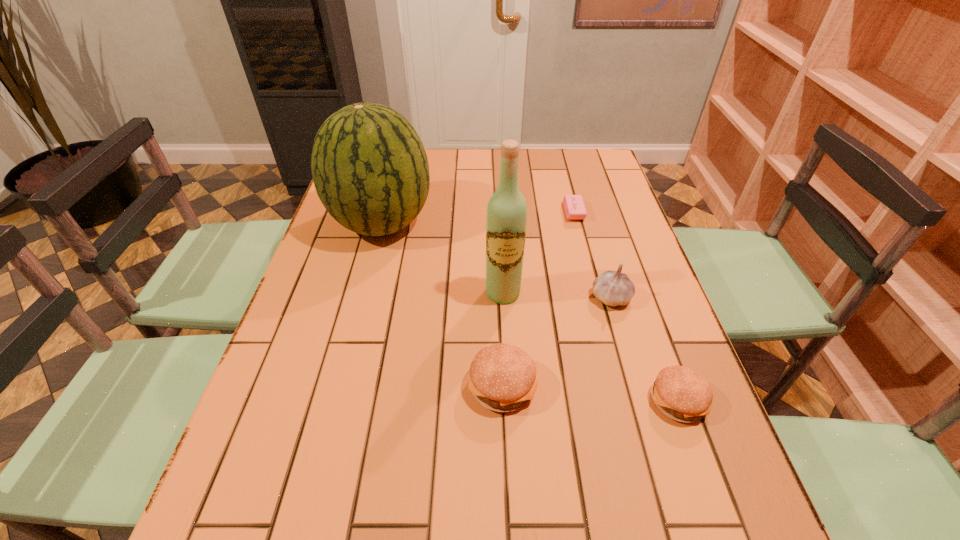
Please point a free position for a hamburger on the left. Please provide its 2D coordinates. Your answer should be formatted as a tuple, i.e. [(x, y)], where the tuple contains the x and y coordinates of a point satisfying the conditions above.

[(337, 371)]